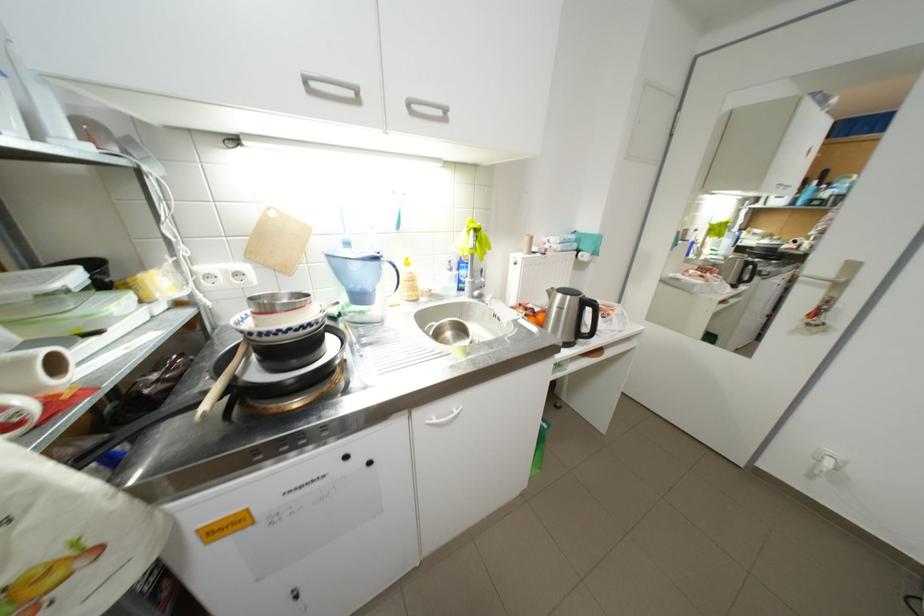
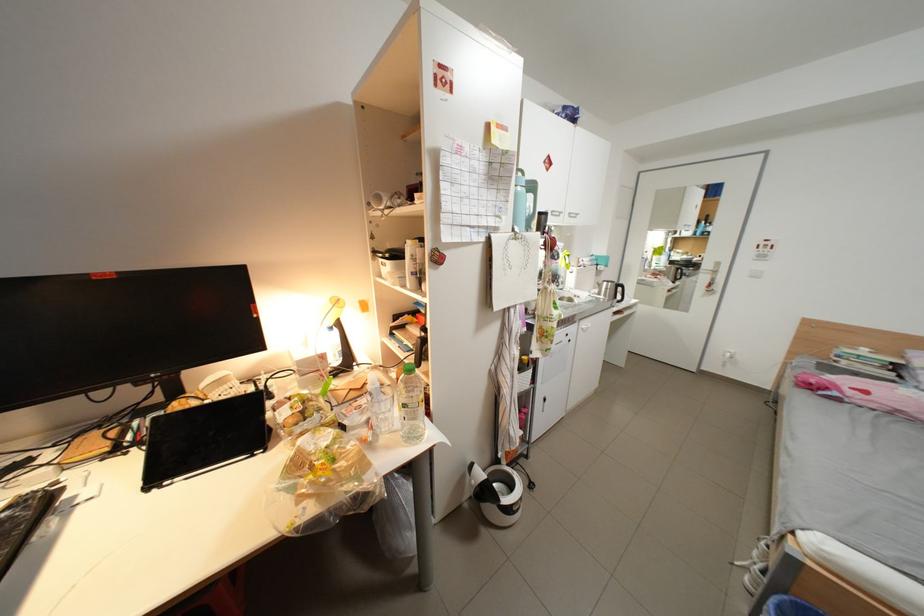
Where in the second image is the point corresponding to point (506, 317) from the first image?

(587, 297)